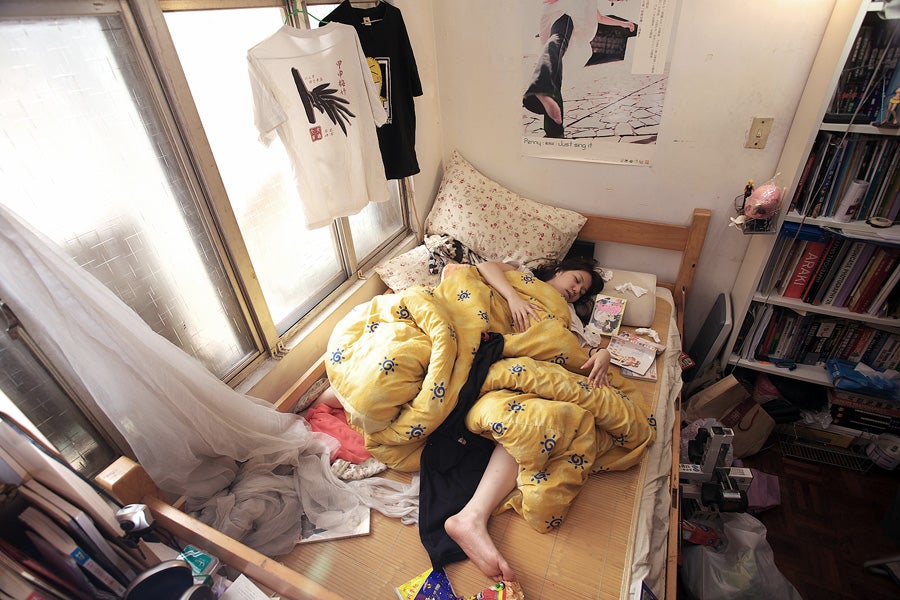
This screenshot has width=900, height=600. In order to click on shelves in this screenshot , I will do `click(806, 376)`, `click(819, 310)`, `click(855, 225)`, `click(861, 128)`, `click(879, 4)`.